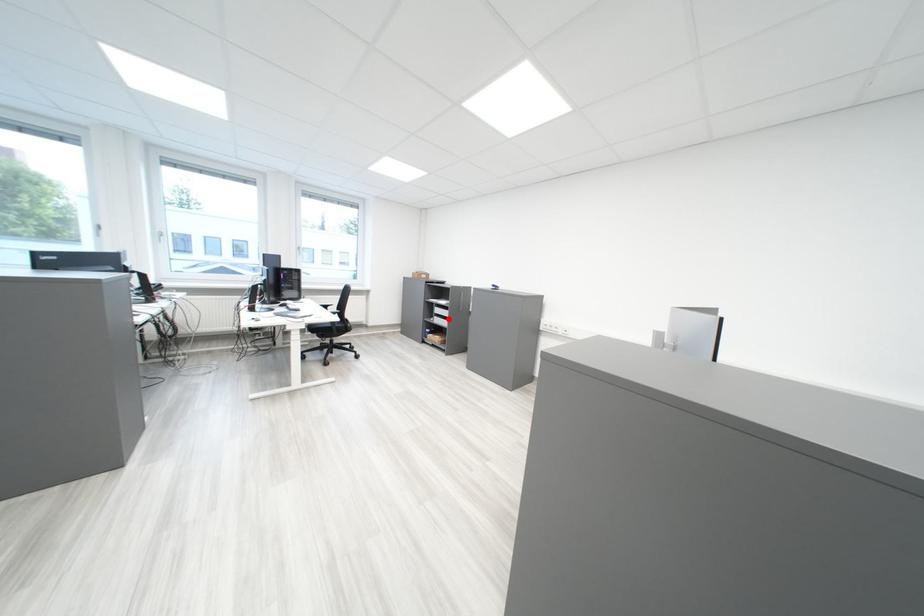
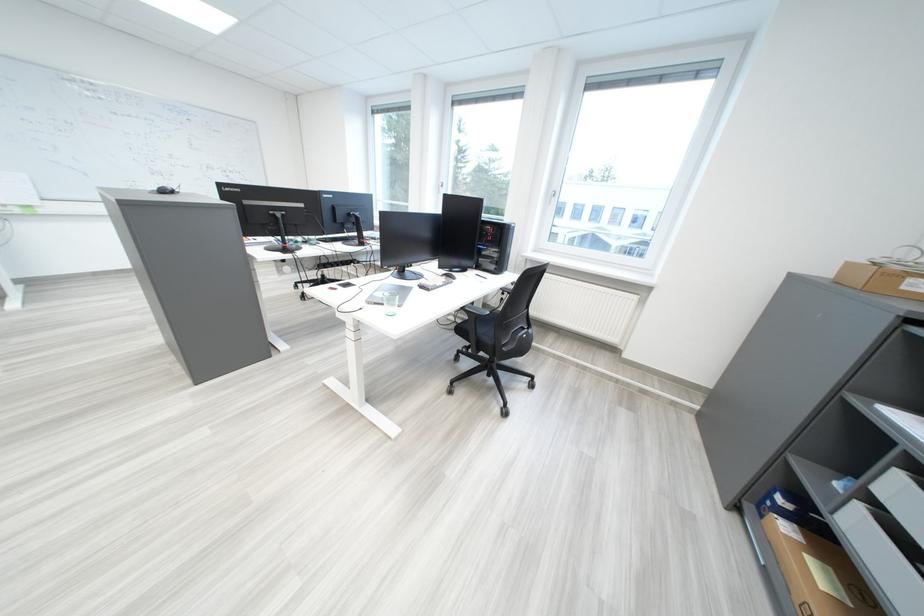
Question: I am providing you with two images of the same scene from different viewpoints. Given a red point in image1, look at the same physical point in image2. Is it:

Choices:
 (A) Closer to the viewpoint
 (B) Farther from the viewpoint

Answer: (B)